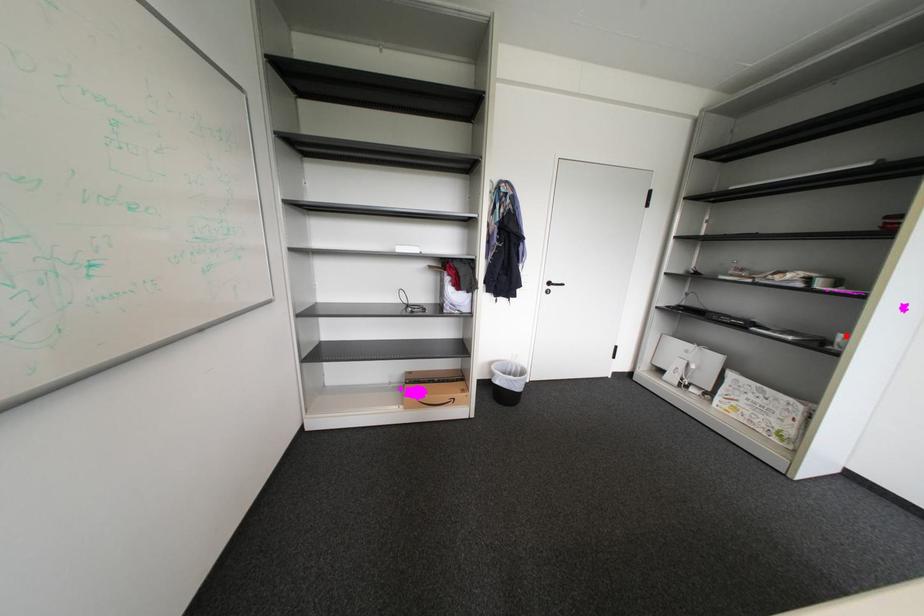
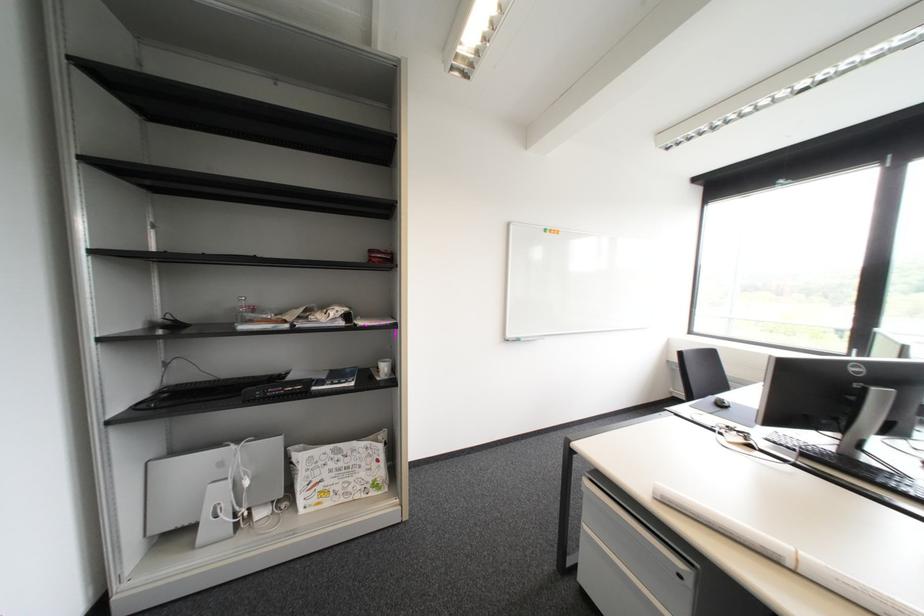
Where in the second image is the point corresponding to the highlighted location from the first image?

(387, 366)